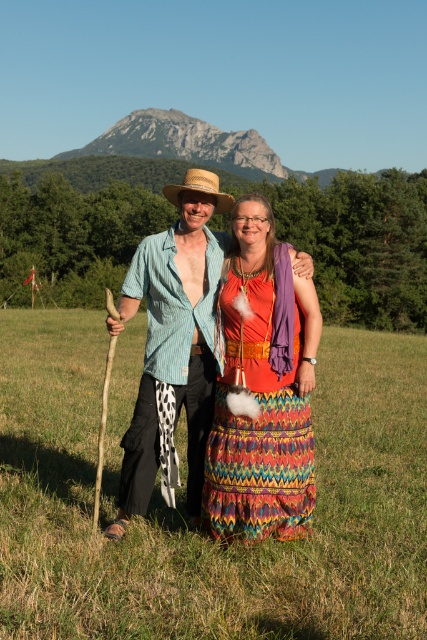
You are a photographer trying to capture the striped cotton shirt at center and the green grass at center in a single shot. Which object should you focus on first if you want to include both in your frame?

The green grass at center is positioned on the left side of striped cotton shirt at center, so you should focus on the striped cotton shirt at center first to ensure both objects are included in the frame.

You are planning to set up a picnic blanket in the green grass at center. The picnic blanket is 10 feet long. You also want to place a large rock decoration at the gray rock formation at upper center. Will the distance between the picnic blanket and the rock formation be enough to allow a person to walk comfortably between them?

The distance between the green grass at center and the gray rock formation at upper center is 329.01 feet. Since the picnic blanket is only 10 feet long, the remaining distance would be 329.01 minus 10, which is 319.01 feet. This is more than enough space for a person to walk comfortably between them.